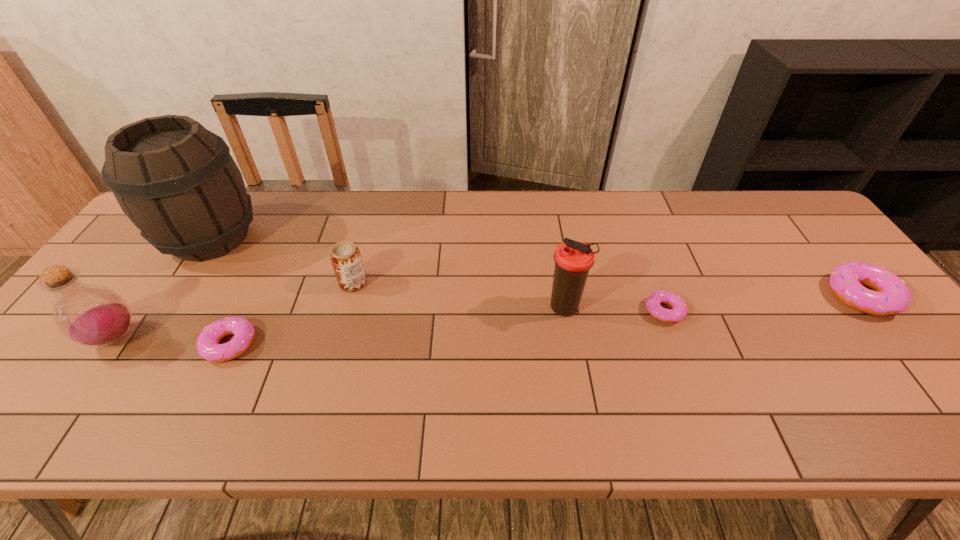
Image resolution: width=960 pixels, height=540 pixels. In order to click on unoccupied area between the bottle and the sixth object from left to right in this screenshot , I will do `click(390, 324)`.

Identify the location of empty space between the beer can and the fifth object from left to right. (459, 295).

You are a GUI agent. You are given a task and a screenshot of the screen. Output one action in this format:
    pyautogui.click(x=<x>, y=<y>)
    Task: Click on the vacant point located between the beer can and the fifth object from left to right
    This screenshot has height=540, width=960.
    Given the screenshot: What is the action you would take?
    pyautogui.click(x=459, y=295)

Where is `blank region between the rightmost object and the sixth object from left to right`? blank region between the rightmost object and the sixth object from left to right is located at coordinates (762, 303).

You are a GUI agent. You are given a task and a screenshot of the screen. Output one action in this format:
    pyautogui.click(x=<x>, y=<y>)
    Task: Click on the free area in between the wine bucket and the second doughnut from left to right
    Image resolution: width=960 pixels, height=540 pixels.
    Given the screenshot: What is the action you would take?
    pyautogui.click(x=438, y=274)

Identify the location of unoccupied area between the leftmost doughnut and the wine bucket. The image size is (960, 540). (221, 291).

This screenshot has height=540, width=960. What are the coordinates of `vacant region between the leftmost doughnut and the third shortest object` in the screenshot? It's located at (545, 320).

Locate an element on the screen. unoccupied position between the bottle and the rightmost object is located at coordinates point(488,317).

This screenshot has height=540, width=960. Identify the location of free space between the shortest object and the bottle. (390, 324).

What are the coordinates of `the second closest object to the fifth object from left to right` in the screenshot? It's located at (346, 260).